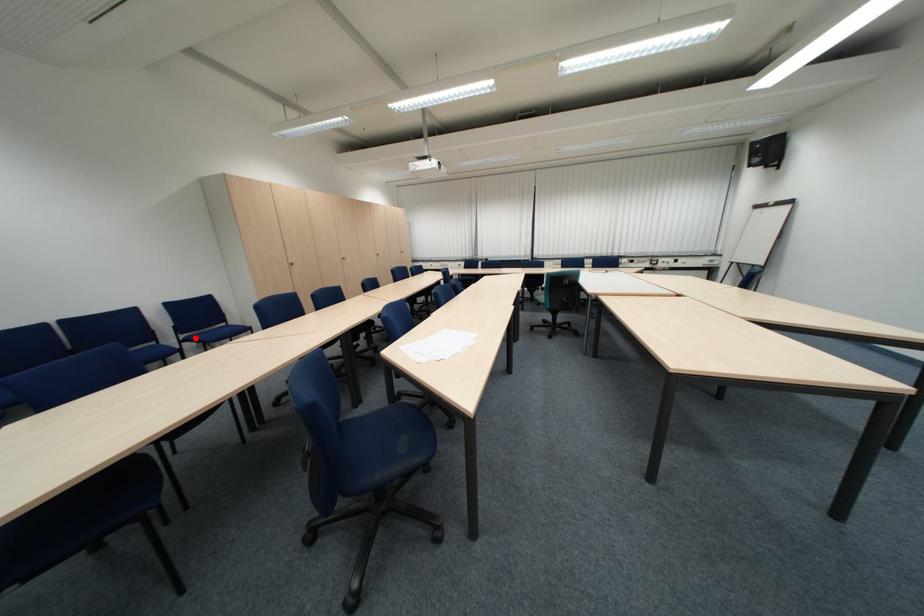
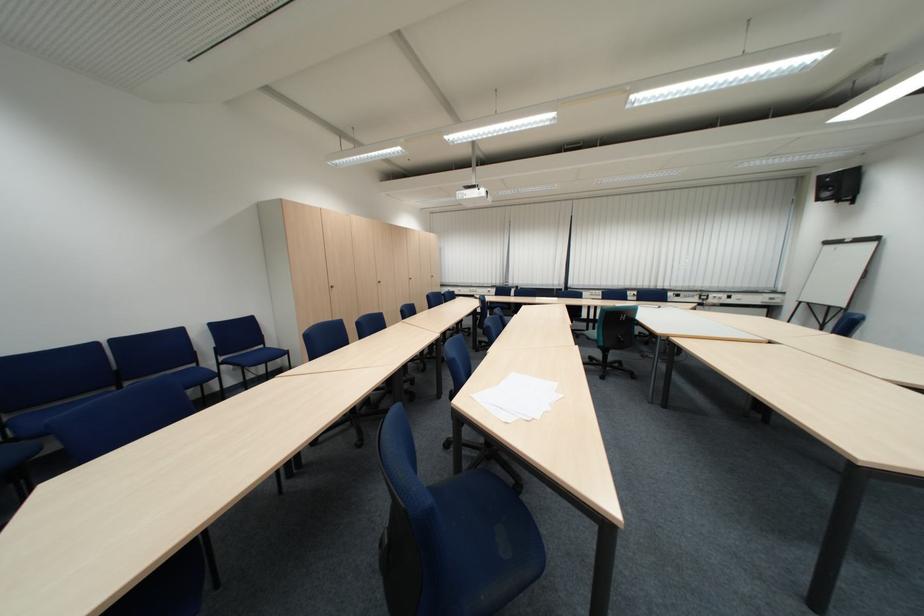
Question: I am providing you with two images of the same scene from different viewpoints. Given a red point in image1, look at the same physical point in image2. Is it:

Choices:
 (A) Closer to the viewpoint
 (B) Farther from the viewpoint

Answer: (B)